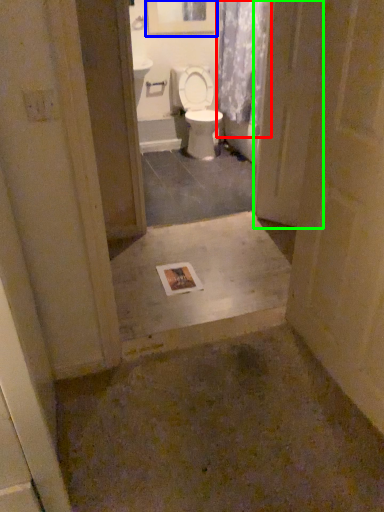
Question: Which object is the closest to the shower curtain (highlighted by a red box)? Choose among these: picture frame (highlighted by a blue box) or screen door (highlighted by a green box).

Choices:
 (A) picture frame
 (B) screen door

Answer: (A)